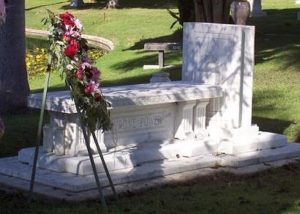
Find the location of a particular element. This screenshot has height=214, width=300. wreath is located at coordinates (81, 62).